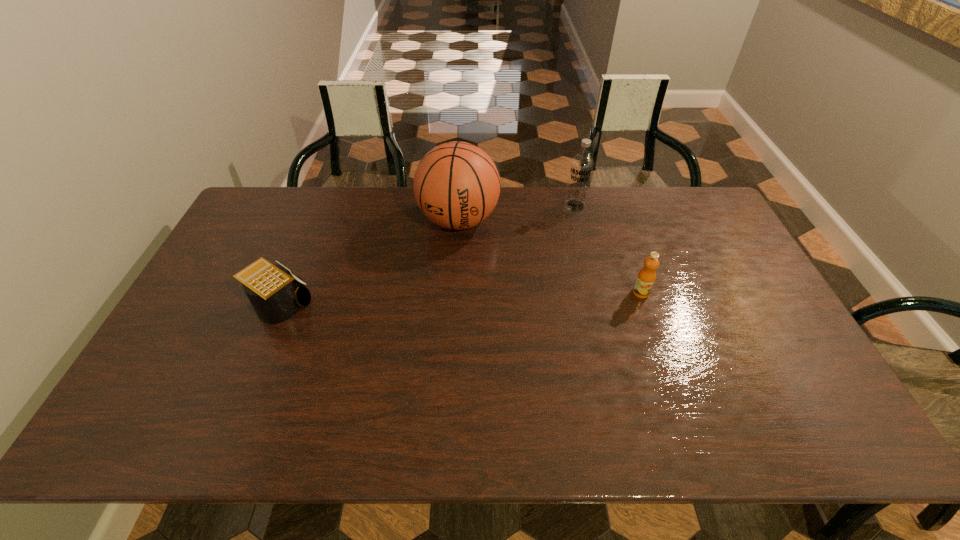
Find the location of a particular element. free region located 0.160m on the surface of the basketball near the brand logo is located at coordinates (443, 283).

You are a GUI agent. You are given a task and a screenshot of the screen. Output one action in this format:
    pyautogui.click(x=<x>, y=<y>)
    Task: Click on the vacant space situated on the front label of the vodka
    
    Given the screenshot: What is the action you would take?
    pyautogui.click(x=557, y=227)

Where is `free space located on the front label of the vodka`? free space located on the front label of the vodka is located at coordinates pyautogui.click(x=514, y=279).

At what (x,y) coordinates should I click in order to perform the action: click on blank space located 0.220m on the front label of the vodka. Please return your answer as a coordinate pair (x, y). The image size is (960, 540). Looking at the image, I should click on (540, 247).

The image size is (960, 540). I want to click on basketball located at the far edge, so click(x=456, y=185).

Where is `vodka present at the far edge`? This screenshot has height=540, width=960. vodka present at the far edge is located at coordinates (581, 166).

Locate an element on the screen. vacant space at the far edge of the desktop is located at coordinates (508, 220).

The image size is (960, 540). In the image, there is a desktop. Find the location of `vacant space at the near edge`. vacant space at the near edge is located at coordinates (522, 386).

In the image, there is a desktop. Where is `blank space at the left edge`? blank space at the left edge is located at coordinates (172, 348).

In the image, there is a desktop. Where is `vacant region at the right edge`? The width and height of the screenshot is (960, 540). vacant region at the right edge is located at coordinates (724, 244).